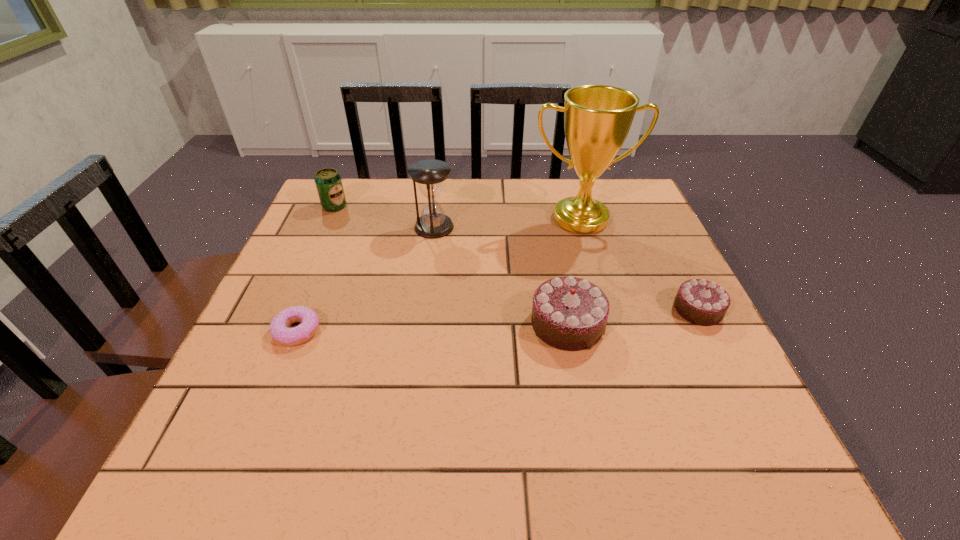
I want to click on award that is at the right edge, so click(x=597, y=118).

Identify the location of object that is at the far left corner. (328, 182).

Locate an element on the screen. Image resolution: width=960 pixels, height=540 pixels. object that is at the far right corner is located at coordinates (597, 118).

The width and height of the screenshot is (960, 540). Find the location of `free space at the far edge of the desktop`. free space at the far edge of the desktop is located at coordinates (519, 184).

This screenshot has width=960, height=540. I want to click on vacant space at the near edge of the desktop, so click(x=482, y=418).

Where is `vacant space at the left edge`? This screenshot has height=540, width=960. vacant space at the left edge is located at coordinates (300, 263).

At what (x,y) coordinates should I click in order to perform the action: click on free space at the near left corner of the desktop. Please return your answer as a coordinate pair (x, y). The image size is (960, 540). Looking at the image, I should click on (254, 389).

Find the location of a particular element. free spot between the tallest object and the taller chocolate cake is located at coordinates (573, 271).

This screenshot has width=960, height=540. I want to click on vacant area that lies between the hourglass and the beer can, so click(384, 217).

Identify the location of vacant area that lies between the rightmost object and the hourglass. (565, 268).